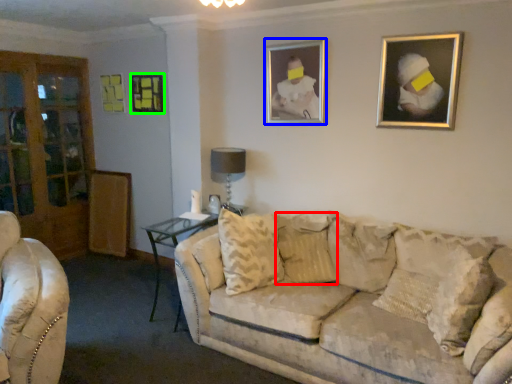
Question: Considering the real-world distances, which object is farthest from pillow (highlighted by a red box)? picture frame (highlighted by a blue box) or picture frame (highlighted by a green box)?

Choices:
 (A) picture frame
 (B) picture frame

Answer: (B)